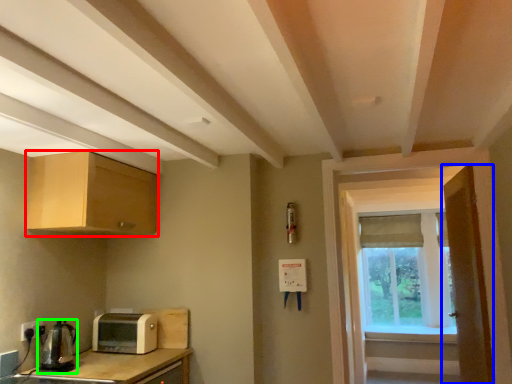
Question: Which object is the closest to the cabinetry (highlighted by a red box)? Choose among these: door (highlighted by a blue box) or coffee machine (highlighted by a green box).

Choices:
 (A) door
 (B) coffee machine

Answer: (B)